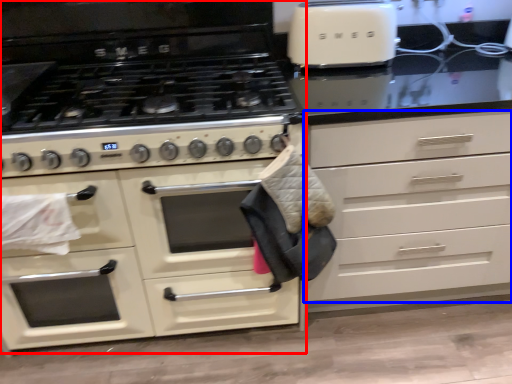
Question: Among these objects, which one is farthest to the camera, cabinetry (highlighted by a red box) or drawer (highlighted by a blue box)?

Choices:
 (A) cabinetry
 (B) drawer

Answer: (A)